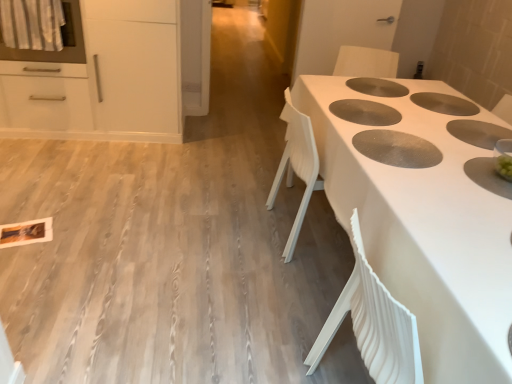
Question: From the image's perspective, is white matte cabinet at upper left under white glossy oven at upper left?

Choices:
 (A) no
 (B) yes

Answer: (B)

Question: Is white matte cabinet at upper left wider than white glossy oven at upper left?

Choices:
 (A) no
 (B) yes

Answer: (B)

Question: Is white matte cabinet at upper left oriented towards white glossy oven at upper left?

Choices:
 (A) no
 (B) yes

Answer: (B)

Question: Can you confirm if white matte cabinet at upper left is positioned to the right of white glossy oven at upper left?

Choices:
 (A) yes
 (B) no

Answer: (A)

Question: Can you confirm if white matte cabinet at upper left is positioned to the left of white glossy oven at upper left?

Choices:
 (A) yes
 (B) no

Answer: (B)

Question: Does point (82, 41) appear closer or farther from the camera than point (393, 66)?

Choices:
 (A) farther
 (B) closer

Answer: (B)

Question: From a real-world perspective, is white glossy oven at upper left positioned above or below white plastic chair at center?

Choices:
 (A) above
 (B) below

Answer: (A)

Question: From their relative heights in the image, would you say white glossy oven at upper left is taller or shorter than white plastic chair at center?

Choices:
 (A) short
 (B) tall

Answer: (A)

Question: Is white glossy oven at upper left wider or thinner than white plastic chair at center?

Choices:
 (A) wide
 (B) thin

Answer: (A)

Question: In terms of height, does white textured table at center look taller or shorter compared to white plastic chair at center?

Choices:
 (A) short
 (B) tall

Answer: (A)

Question: Based on their sizes in the image, would you say white textured table at center is bigger or smaller than white plastic chair at center?

Choices:
 (A) small
 (B) big

Answer: (B)

Question: Do you think white textured table at center is within white plastic chair at center, or outside of it?

Choices:
 (A) outside
 (B) inside

Answer: (A)

Question: In the image, is white textured table at center on the left side or the right side of white plastic chair at center?

Choices:
 (A) right
 (B) left

Answer: (A)

Question: Looking at their shapes, would you say white plastic chair at center is wider or thinner than white glossy oven at upper left?

Choices:
 (A) thin
 (B) wide

Answer: (A)

Question: Considering the relative positions of white plastic chair at center and white glossy oven at upper left in the image provided, is white plastic chair at center to the left or to the right of white glossy oven at upper left?

Choices:
 (A) right
 (B) left

Answer: (A)